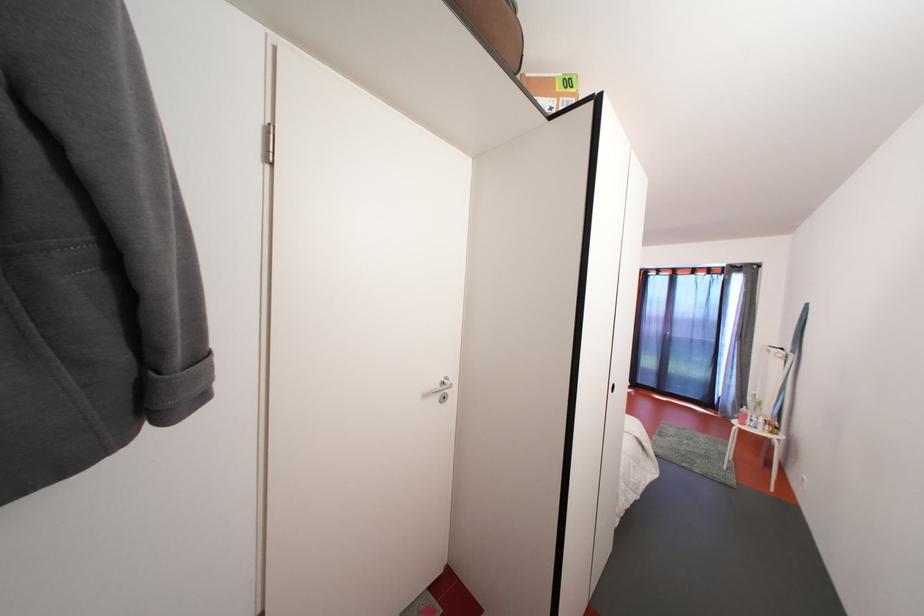
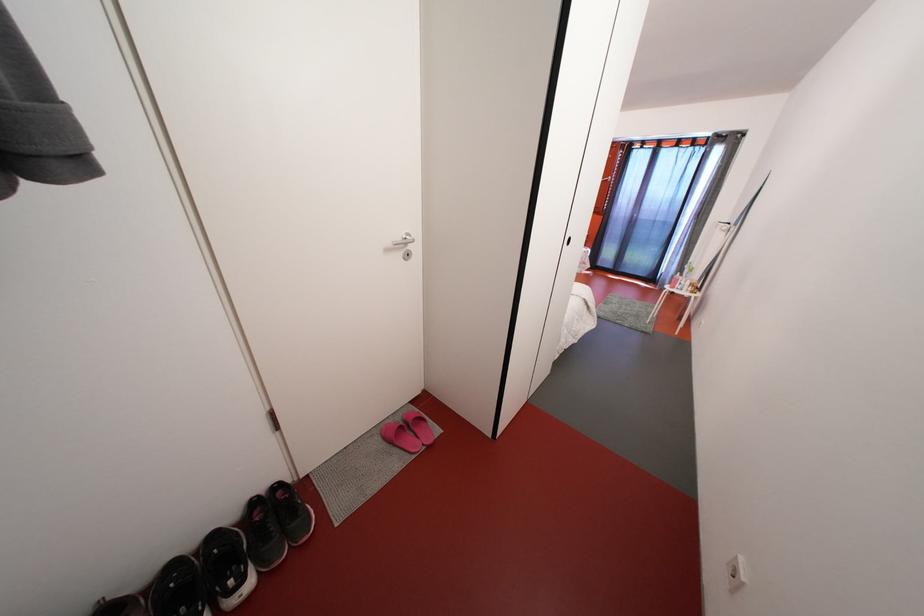
Question: How did the camera likely rotate?

Choices:
 (A) Left
 (B) Right
 (C) Up
 (D) Down

Answer: (D)